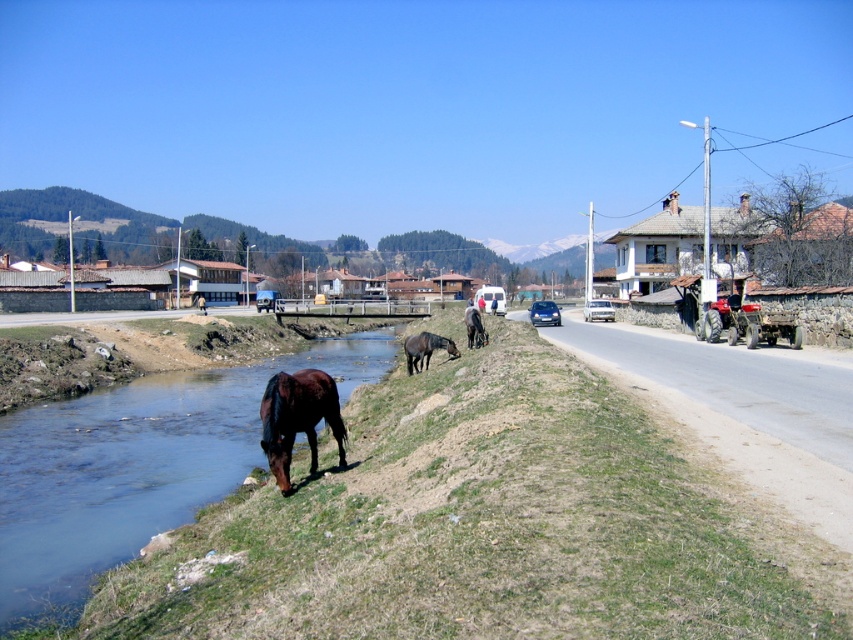
Is brown glossy horse at lower center above brown glossy horse at center?

Incorrect, brown glossy horse at lower center is not positioned above brown glossy horse at center.

Is brown glossy horse at lower center taller than brown glossy horse at center?

In fact, brown glossy horse at lower center may be shorter than brown glossy horse at center.

Is point (408, 365) positioned before point (485, 339)?

Yes, point (408, 365) is in front of point (485, 339).

At what (x,y) coordinates should I click in order to perform the action: click on brown glossy horse at lower center. Please return your answer as a coordinate pair (x, y). Looking at the image, I should click on pyautogui.click(x=425, y=349).

Does green grass at lower left have a lesser width compared to brown grassy stream at lower left?

Indeed, green grass at lower left has a lesser width compared to brown grassy stream at lower left.

Consider the image. Measure the distance from green grass at lower left to brown grassy stream at lower left.

6.05 meters

Is point (828, 561) behind point (169, 518)?

No, (828, 561) is in front of (169, 518).

At what (x,y) coordinates should I click in order to perform the action: click on green grass at lower left. Please return your answer as a coordinate pair (x, y). Looking at the image, I should click on (486, 525).

Image resolution: width=853 pixels, height=640 pixels. Describe the element at coordinates (297, 419) in the screenshot. I see `brown glossy horse at lower left` at that location.

Who is taller, brown glossy horse at lower left or brown glossy horse at lower center?

brown glossy horse at lower center is taller.

Between point (262, 412) and point (415, 368), which one is positioned in front?

Positioned in front is point (262, 412).

You are a GUI agent. You are given a task and a screenshot of the screen. Output one action in this format:
    pyautogui.click(x=<x>, y=<y>)
    Task: Click on the brown glossy horse at lower left
    This screenshot has width=853, height=640.
    Given the screenshot: What is the action you would take?
    pyautogui.click(x=297, y=419)